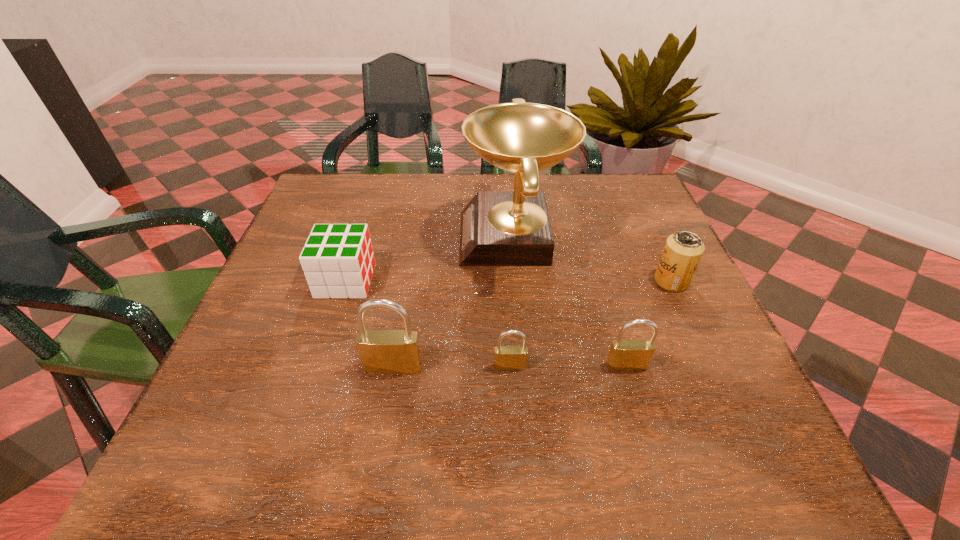
This screenshot has height=540, width=960. In order to click on the leftmost padlock in this screenshot , I will do `click(388, 352)`.

Identify the location of the tallest padlock. This screenshot has height=540, width=960. (388, 352).

Where is `the second padlock from right to left`? The image size is (960, 540). the second padlock from right to left is located at coordinates (507, 358).

Locate an element on the screen. This screenshot has height=540, width=960. the second tallest padlock is located at coordinates (625, 355).

This screenshot has width=960, height=540. In order to click on the rightmost padlock in this screenshot , I will do `click(625, 355)`.

You are a GUI agent. You are given a task and a screenshot of the screen. Output one action in this format:
    pyautogui.click(x=<x>, y=<y>)
    Task: Click on the tallest object
    
    Given the screenshot: What is the action you would take?
    pyautogui.click(x=498, y=228)

I want to click on cube, so click(x=338, y=261).

Where is `the rightmost object`? the rightmost object is located at coordinates pos(683,250).

You are a GUI agent. You are given a task and a screenshot of the screen. Output one action in this format:
    pyautogui.click(x=<x>, y=<y>)
    Task: Click on the free region located 0.050m on the front-facing side of the shortest padlock
    The height and width of the screenshot is (540, 960).
    Given the screenshot: What is the action you would take?
    pyautogui.click(x=512, y=395)

At what (x,y) coordinates should I click in order to perform the action: click on vacant space located on the front-facing side of the tallest object. Please return your answer as a coordinate pair (x, y). This screenshot has width=960, height=540. Looking at the image, I should click on (305, 238).